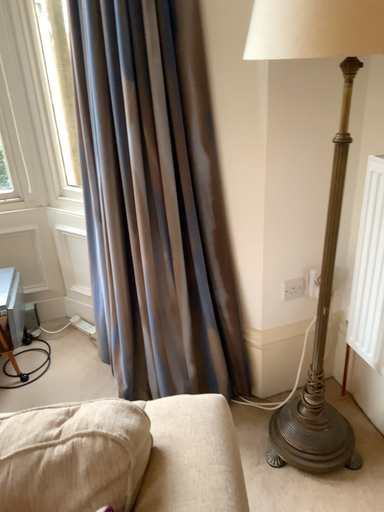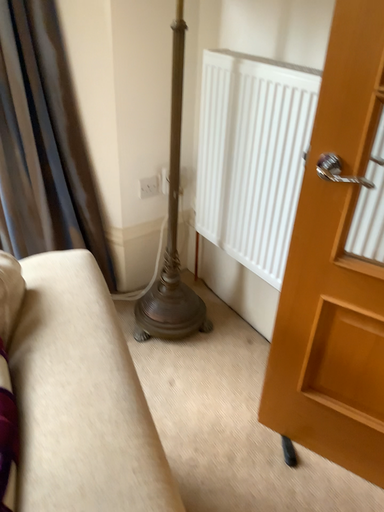
Question: Which way did the camera rotate in the video?

Choices:
 (A) rotated left
 (B) rotated right

Answer: (B)